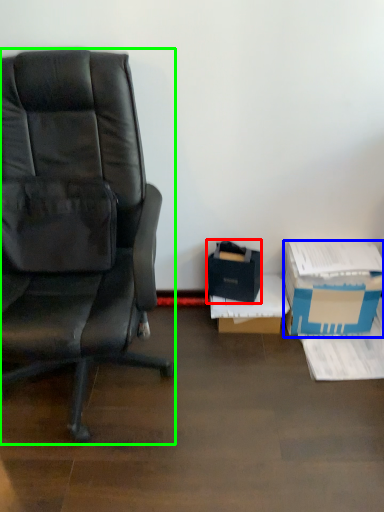
Question: Considering the real-world distances, which object is closest to box (highlighted by a red box)? box (highlighted by a blue box) or chair (highlighted by a green box).

Choices:
 (A) box
 (B) chair

Answer: (A)